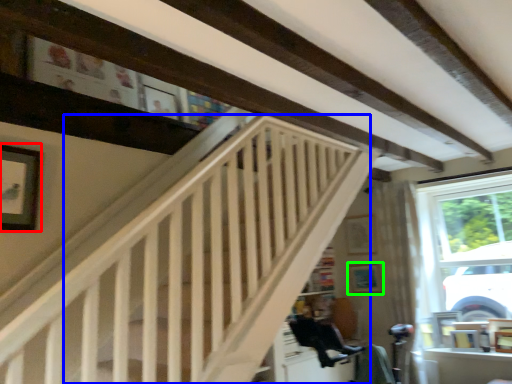
Question: Which is nearer to the picture frame (highlighted by a red box)? stairwell (highlighted by a blue box) or picture frame (highlighted by a green box).

Choices:
 (A) stairwell
 (B) picture frame

Answer: (A)